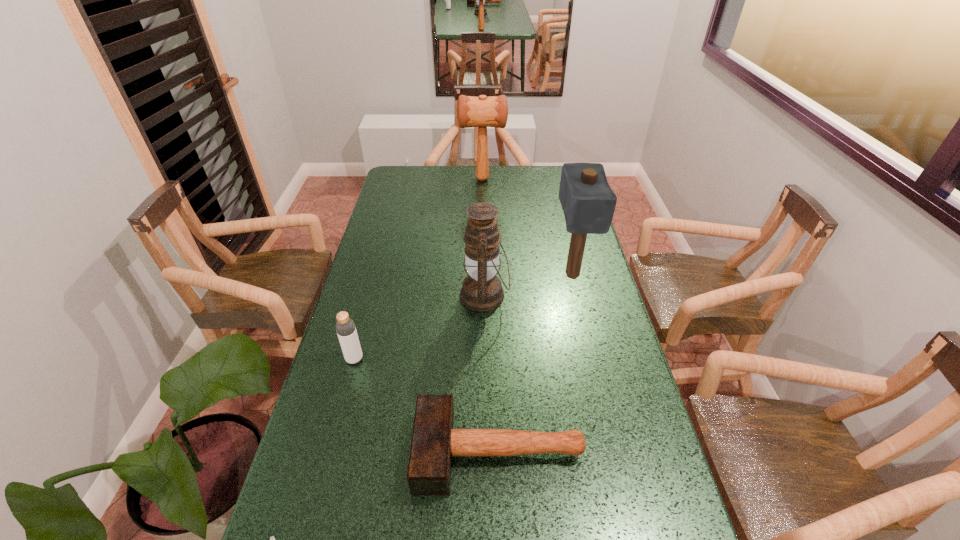
At what (x,y) coordinates should I click in order to perform the action: click on vacant space at the far edge of the desktop. Please return your answer as a coordinate pair (x, y). Looking at the image, I should click on (430, 167).

The height and width of the screenshot is (540, 960). Identify the location of vacant space at the left edge of the desktop. (380, 214).

What are the coordinates of `free region at the right edge of the desktop` in the screenshot? It's located at (553, 235).

The image size is (960, 540). In the image, there is a desktop. Identify the location of vacant space at the far left corner. (407, 176).

Find the location of a particular element. The image size is (960, 540). vacant point located between the bottle and the oil lamp is located at coordinates (x=420, y=327).

You are a GUI agent. You are given a task and a screenshot of the screen. Output one action in this format:
    pyautogui.click(x=<x>, y=<y>)
    Task: Click on the free space between the fifth tallest object and the oil lamp
    The image size is (960, 540).
    Given the screenshot: What is the action you would take?
    pyautogui.click(x=492, y=374)

I want to click on free area in between the oil lamp and the nearest mallet, so click(x=492, y=374).

I want to click on vacant area that lies between the nearest mallet and the rightmost mallet, so click(536, 363).

At what (x,y) coordinates should I click in order to perform the action: click on blank region between the rightmost object and the shortest mallet. Please return your answer as a coordinate pair (x, y). The image size is (960, 540). Looking at the image, I should click on (536, 363).

This screenshot has height=540, width=960. What are the coordinates of `the fourth closest object to the nearest mallet` in the screenshot? It's located at (588, 202).